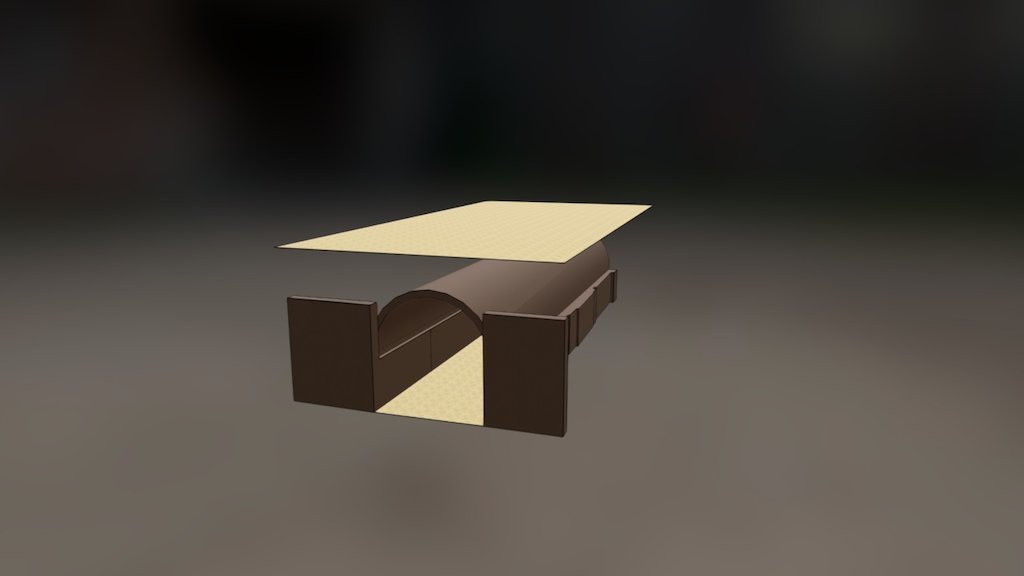
Where is `floor`? This screenshot has width=1024, height=576. floor is located at coordinates (450, 410).